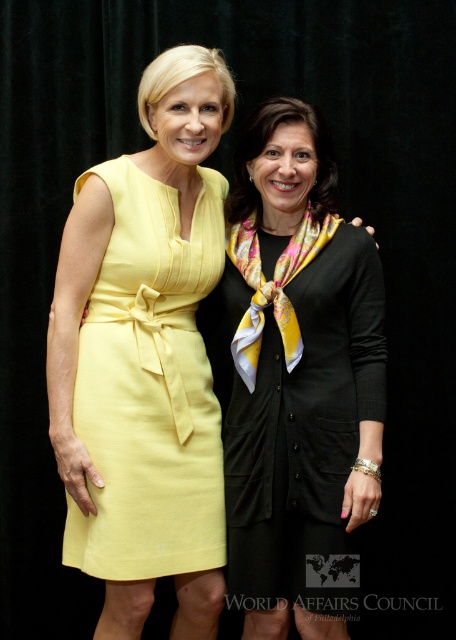
Who is positioned more to the right, black silk dress at center or linen yellow dress at left?

black silk dress at center is more to the right.

Who is lower down, black silk dress at center or linen yellow dress at left?

Positioned lower is black silk dress at center.

Who is more forward, (341,404) or (97,561)?

Point (97,561)

Locate an element on the screen. This screenshot has width=456, height=640. black silk dress at center is located at coordinates (295, 380).